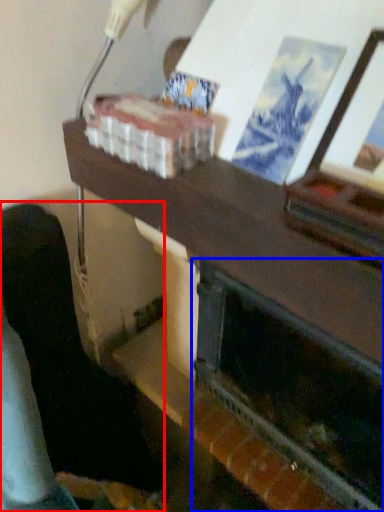
Question: Which object is closer to the camera taking this photo, furniture (highlighted by a red box) or fireplace (highlighted by a blue box)?

Choices:
 (A) furniture
 (B) fireplace

Answer: (B)